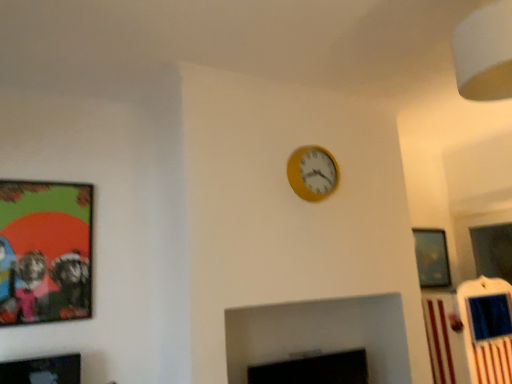
Question: From their relative heights in the image, would you say yellow matte wall clock at upper center is taller or shorter than matte black picture frame at lower left, the 2th picture frame when ordered from left to right?

Choices:
 (A) short
 (B) tall

Answer: (B)

Question: Considering the positions of point (318, 187) and point (41, 382), is point (318, 187) closer or farther from the camera than point (41, 382)?

Choices:
 (A) farther
 (B) closer

Answer: (A)

Question: Estimate the real-world distances between objects in this image. Which object is farther from the matte black picture frame at lower left, arranged as the 3th picture frame when viewed from the back?

Choices:
 (A) black matte fireplace at lower center
 (B) matte plastic picture frame at left, the second picture frame when ordered from front to back
 (C) yellow matte wall clock at upper center
 (D) metallic silver picture frame at upper right, which is the first picture frame from right to left

Answer: (D)

Question: Which object is positioned closest to the metallic silver picture frame at upper right, which appears as the third picture frame when viewed from the front?

Choices:
 (A) yellow matte wall clock at upper center
 (B) matte plastic picture frame at left, which appears as the third picture frame when viewed from the right
 (C) matte black picture frame at lower left, arranged as the 3th picture frame when viewed from the back
 (D) black matte fireplace at lower center

Answer: (D)